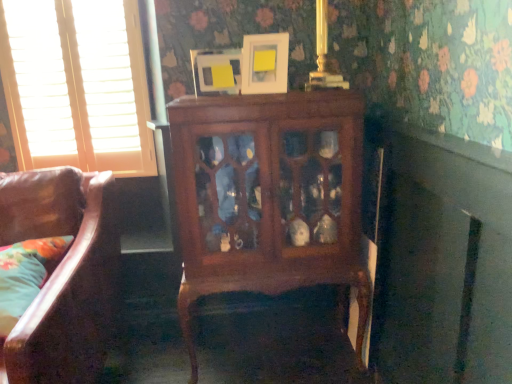
Question: Does point (244, 77) appear closer or farther from the camera than point (7, 299)?

Choices:
 (A) closer
 (B) farther

Answer: (B)

Question: Is white matte picture frame at upper center, acting as the 2th picture frame starting from the left, taller or shorter than fluffy fabric pillow at lower left?

Choices:
 (A) short
 (B) tall

Answer: (B)

Question: Estimate the real-world distances between objects in this image. Which object is farther from the matte white picture frame at upper center, positioned as the 2th picture frame in right-to-left order?

Choices:
 (A) white wood blinds at left
 (B) mahogany cabinet at center
 (C) fluffy fabric pillow at lower left
 (D) white matte picture frame at upper center, acting as the 2th picture frame starting from the left

Answer: (C)

Question: Estimate the real-world distances between objects in this image. Which object is farther from the white matte picture frame at upper center, acting as the 2th picture frame starting from the left?

Choices:
 (A) white wood blinds at left
 (B) fluffy fabric pillow at lower left
 (C) mahogany cabinet at center
 (D) matte white picture frame at upper center, positioned as the 2th picture frame in right-to-left order

Answer: (B)